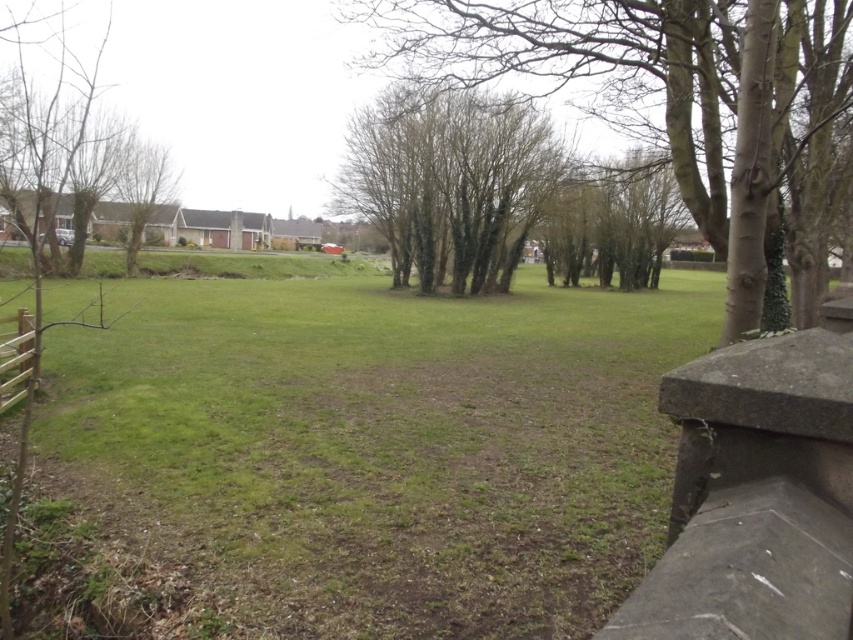
You are standing at the bottom right corner of the image. Looking towards the center, can you see the bare branches at center? Please explain your reasoning based on the scene description.

Yes, the bare branches at center are located at point [656,92] in the image. Since you are at the bottom right corner, which is near the concrete structure, there is a clear line of sight towards the center of the image. The midground has a lawn and trees, but they are in a line and spaced closely, so they might not block the view. The scene description doesn not mention any obstacles between the bottom right corner and the center, so you should be able to see the bare branches at center.

You are standing in the park and want to walk from the point at coordinates (668, 29) to the point at coordinates (138, 218). Which direction should you head to reach the second point?

You should head towards the lower right direction to reach the point at coordinates (138, 218) from the point at coordinates (668, 29).

You are standing in the park and see the bare branches at center and the brown leafless tree at left. Which one is closer to you?

The bare branches at center is closer to you because it is in front of the brown leafless tree at left.